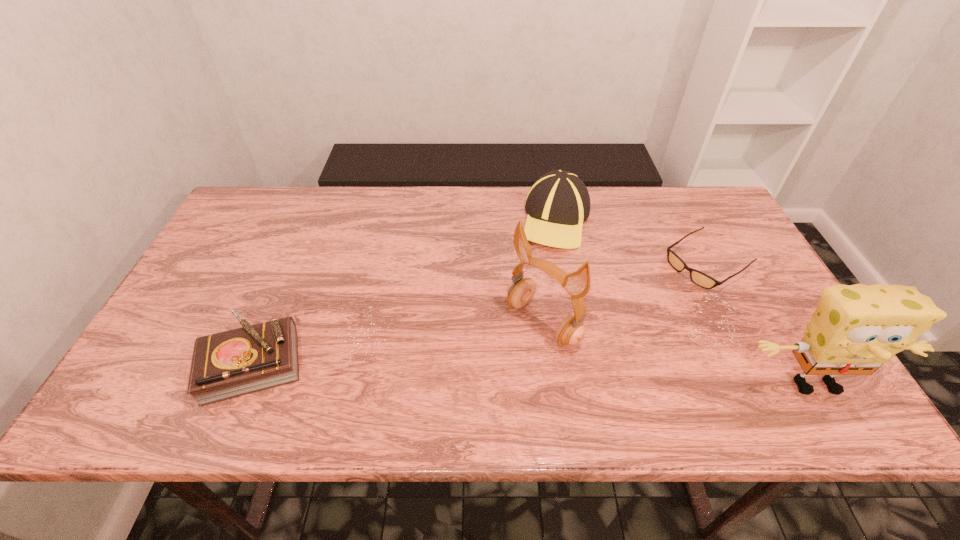
Identify the location of sunglasses present at the right edge. (699, 278).

Locate an element on the screen. The image size is (960, 540). object at the near left corner is located at coordinates (229, 364).

Where is `object present at the near right corner`? object present at the near right corner is located at coordinates (856, 329).

Locate an element on the screen. The width and height of the screenshot is (960, 540). vacant space at the far edge of the desktop is located at coordinates (653, 233).

Identify the location of free space at the near edge of the desktop. Image resolution: width=960 pixels, height=540 pixels. (320, 369).

Where is `free space at the left edge of the desktop`? free space at the left edge of the desktop is located at coordinates (264, 244).

You are a GUI agent. You are given a task and a screenshot of the screen. Output one action in this format:
    pyautogui.click(x=<x>, y=<y>)
    Task: Click on the free space at the right edge of the desktop
    
    Given the screenshot: What is the action you would take?
    pyautogui.click(x=781, y=345)

Identify the location of free space at the far left corner of the desktop. (265, 234).

Image resolution: width=960 pixels, height=540 pixels. In order to click on free space at the far right corner in this screenshot , I will do `click(663, 192)`.

Where is `free space that is in between the diary and the earphone`? free space that is in between the diary and the earphone is located at coordinates (397, 343).